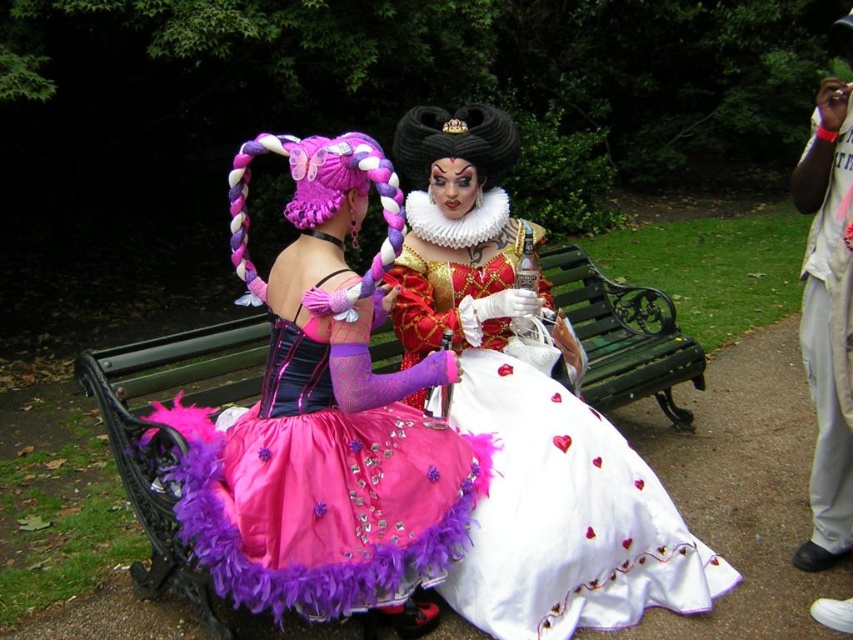
You are planning to take a photo of the white satin dress at center and the green wooden bench at center. Based on their sizes, which one should you focus on first if you want to ensure both are fully visible in the frame?

The white satin dress at center is smaller than the green wooden bench at center, so you should focus on the green wooden bench at center first to ensure it fits properly in the frame, allowing space for the smaller dress.

You are a photographer trying to capture the purple feathered dress at center in the park. The park bench is located at coordinates point (x=328, y=420). Can you confirm if the purple feathered dress at center is positioned exactly at the park bench coordinates?

Yes, the purple feathered dress at center is positioned exactly at the park bench coordinates marked by point (x=328, y=420).

Consider the image. You are a photographer trying to capture both the purple feathered dress at center and the white satin dress at center in a single shot. Based on their positions, which dress will appear more prominent in the photo?

The purple feathered dress at center appears more prominent because it is positioned over the white satin dress at center, making it stand out visually.